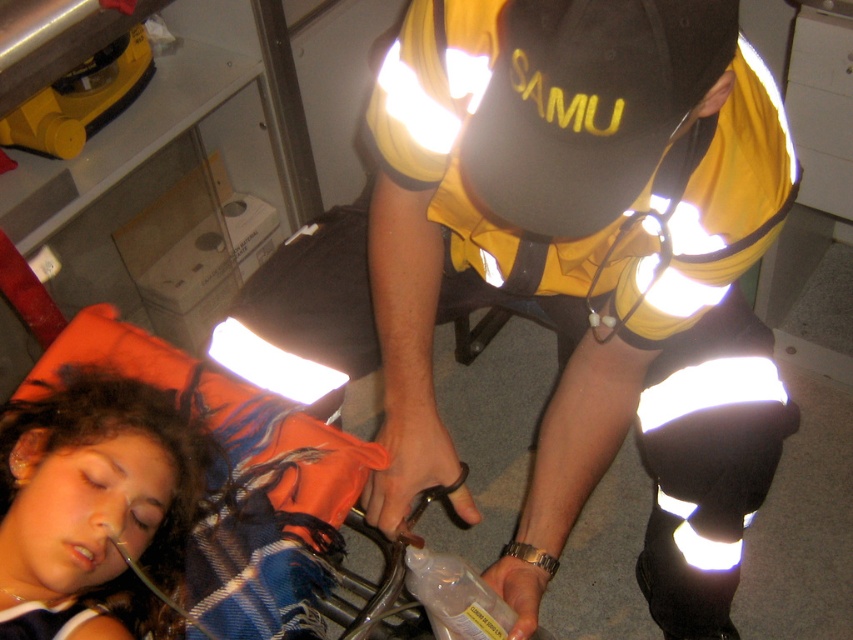
You are a photographer trying to capture a closeup of the paramedic performing CPR on the patient. The camera you have can only focus on objects within 1 meter. Given that the point where the paramedic is touching the patient is at point (579, 369), can you get a clear photo?

The point (579, 369) is 1.12 meters away from the camera, so the camera cannot focus on it since it is beyond the 1 meter range.

In the emergency scene described, you need to quickly identify the tallest object between the reflective yellow vest at center and the orange fabric pillow at lower left. Which one is taller?

The reflective yellow vest at center is much taller as orange fabric pillow at lower left.

Based on the photo, based on the coordinates provided, is the reflective yellow vest at center located to the left or right of the point marked at [566,221]?

The reflective yellow vest at center is exactly at the point marked at [566,221], so it is neither to the left nor right of that point.